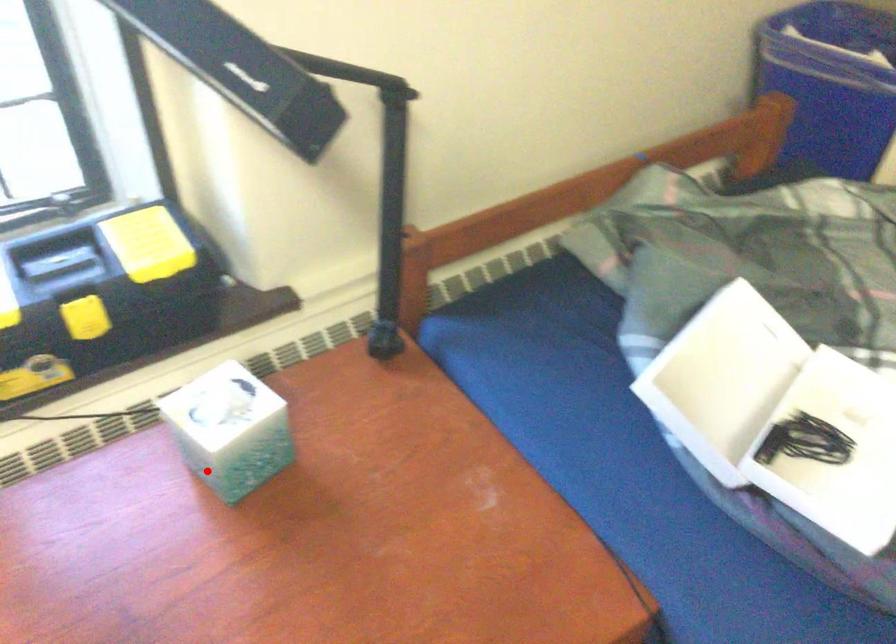
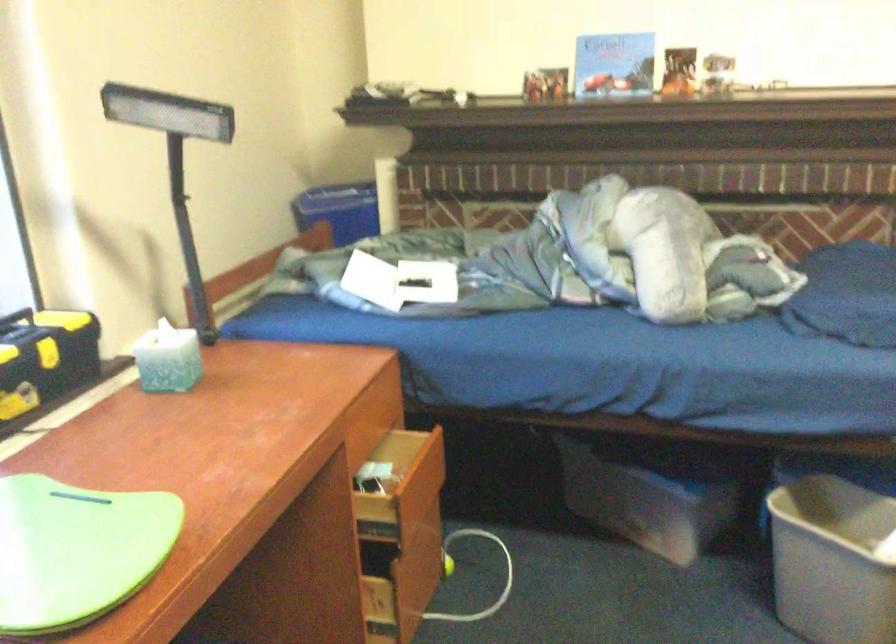
Find the pixel in the second image that matches the highlighted location in the first image.

(168, 359)